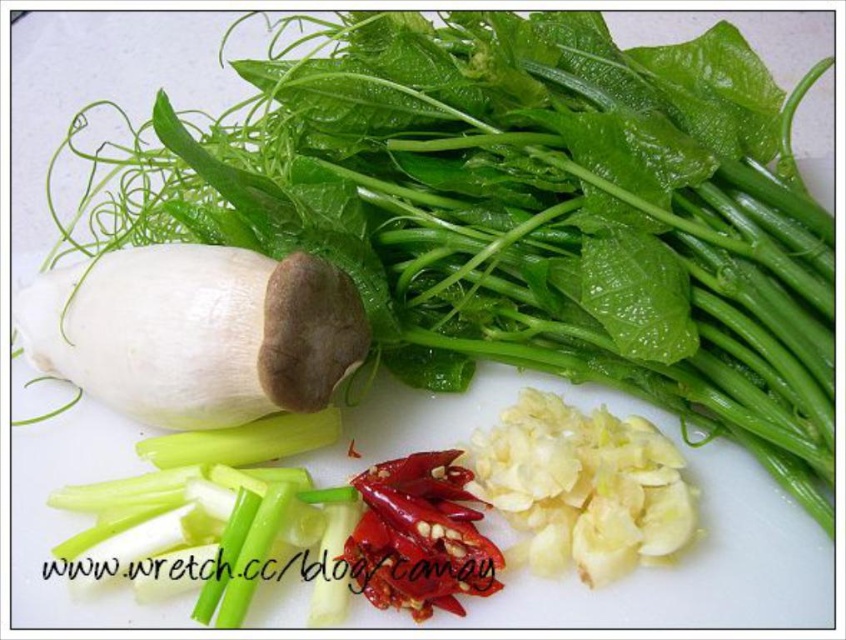
You are preparing a dish and need to know the spatial arrangement of the ingredients. Which object is positioned to the left when looking at the white matte garlic at center and the red matte pepper at center?

The white matte garlic at center is to the left of the red matte pepper at center.

Consider the image. You are a chef preparing a dish and need to access both the white matte garlic at center and the red matte pepper at center. Which one is closer to you?

The white matte garlic at center is closer to you since it is in front of the red matte pepper at center.